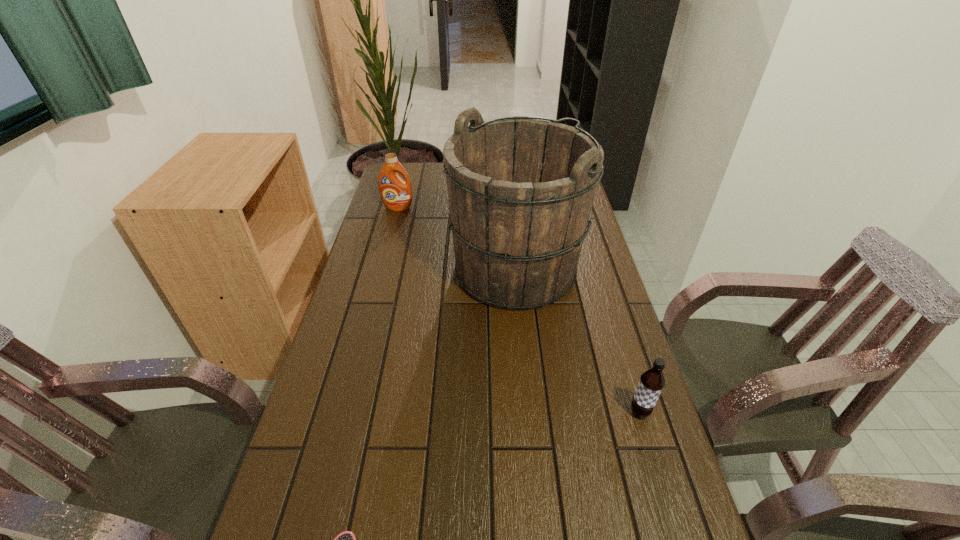
The height and width of the screenshot is (540, 960). Find the location of `bucket that is at the right edge`. bucket that is at the right edge is located at coordinates (520, 190).

I want to click on root beer that is at the right edge, so click(651, 383).

Where is `blank space at the far edge`? blank space at the far edge is located at coordinates (444, 188).

At what (x,y) coordinates should I click in order to perform the action: click on free space at the left edge of the desktop. Please return your answer as a coordinate pair (x, y). This screenshot has width=960, height=540. Looking at the image, I should click on (383, 293).

In the image, there is a desktop. Identify the location of vacant space at the right edge. Image resolution: width=960 pixels, height=540 pixels. (588, 385).

In the image, there is a desktop. Where is `free space at the far left corner`? free space at the far left corner is located at coordinates (415, 182).

Find the location of `vacant space that is in between the third object from left to right and the second shortest object`. vacant space that is in between the third object from left to right and the second shortest object is located at coordinates (578, 341).

Locate an element on the screen. Image resolution: width=960 pixels, height=540 pixels. object that is the second closest one to the detergent is located at coordinates (651, 383).

Identify which object is located as the third nearest to the shortest object. Please provide its 2D coordinates. Your answer should be formatted as a tuple, i.e. [(x, y)], where the tuple contains the x and y coordinates of a point satisfying the conditions above.

[(396, 194)]

This screenshot has width=960, height=540. I want to click on free space that satisfies the following two spatial constraints: 1. on the front side of the bucket; 2. on the right side of the second nearest object, so click(x=529, y=412).